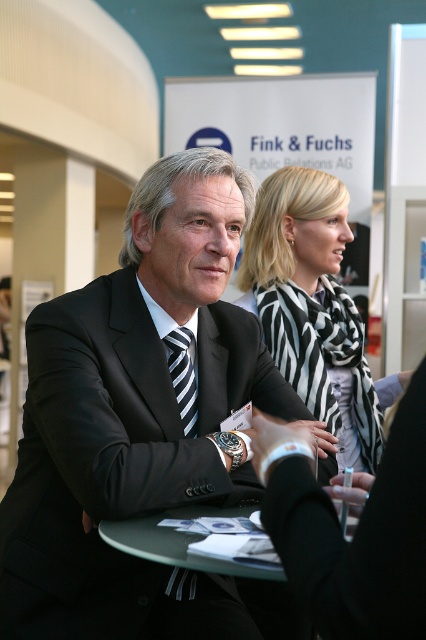
Question: Does matte black suit at center come in front of black and white scarf at upper center?

Choices:
 (A) yes
 (B) no

Answer: (A)

Question: Which object is the farthest from the black and white scarf at upper center?

Choices:
 (A) matte black suit at center
 (B) striped fabric tie at center

Answer: (B)

Question: Which of the following is the farthest from the observer?

Choices:
 (A) (305, 262)
 (B) (89, 332)

Answer: (A)

Question: Can you confirm if matte black suit at center is positioned above striped fabric tie at center?

Choices:
 (A) yes
 (B) no

Answer: (B)

Question: Considering the real-world distances, which object is closest to the black and white scarf at upper center?

Choices:
 (A) striped fabric tie at center
 (B) matte black suit at center

Answer: (B)

Question: Is the position of matte black suit at center less distant than that of black and white scarf at upper center?

Choices:
 (A) no
 (B) yes

Answer: (B)